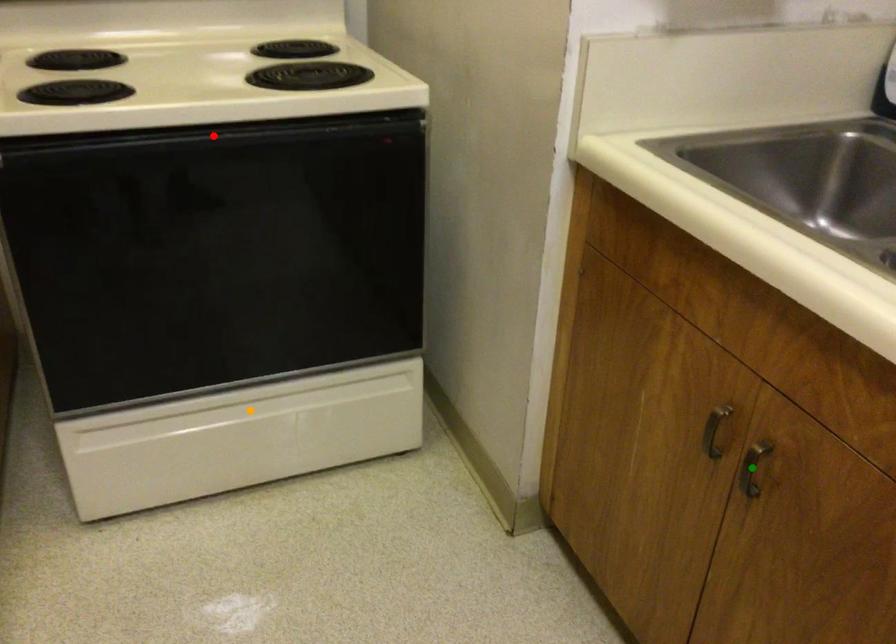
Order these from nearest to farthest:
1. green point
2. red point
3. orange point

1. green point
2. red point
3. orange point